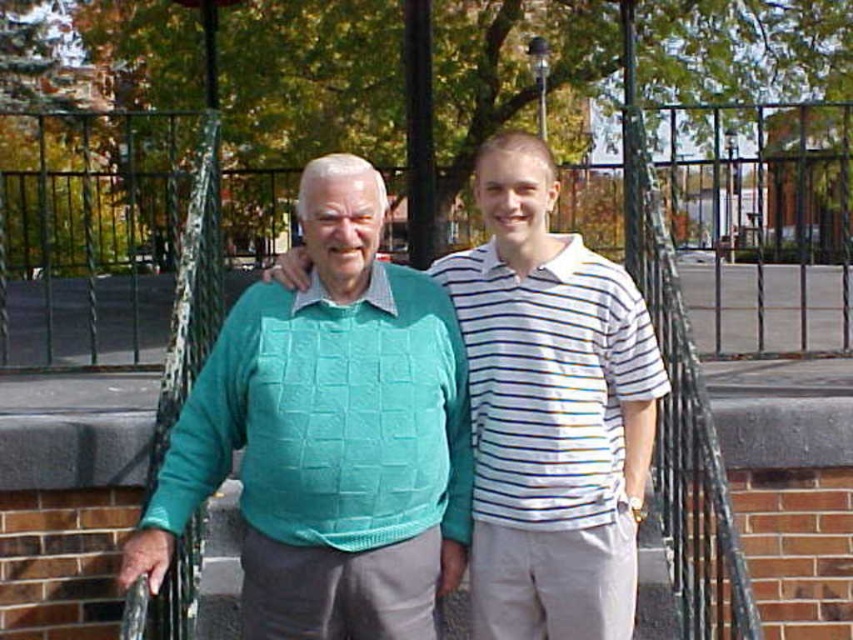
You are a photographer trying to capture a photo of the white striped polo shirt at center without including the green wire fence at center in the frame. Based on their heights, is this possible?

The green wire fence at center is taller than the white striped polo shirt at center, so it is possible to frame the photo to exclude the fence by adjusting the camera angle to focus only on the polo shirt.

You are trying to take a photo of the green wire fence at center and the white striped polo shirt at center. Which object is wider in the image?

The green wire fence at center is wider than the white striped polo shirt at center according to the description.

You are a photographer setting up for a group photo. You need to ensure that the teal knitted sweater at center and the white striped polo shirt at center are at least 50 centimeters apart for proper framing. Based on the current positions, is this requirement met?

The distance between the teal knitted sweater at center and the white striped polo shirt at center is 47.11 centimeters, which is less than the required 50 centimeters. Therefore, the requirement is not met.